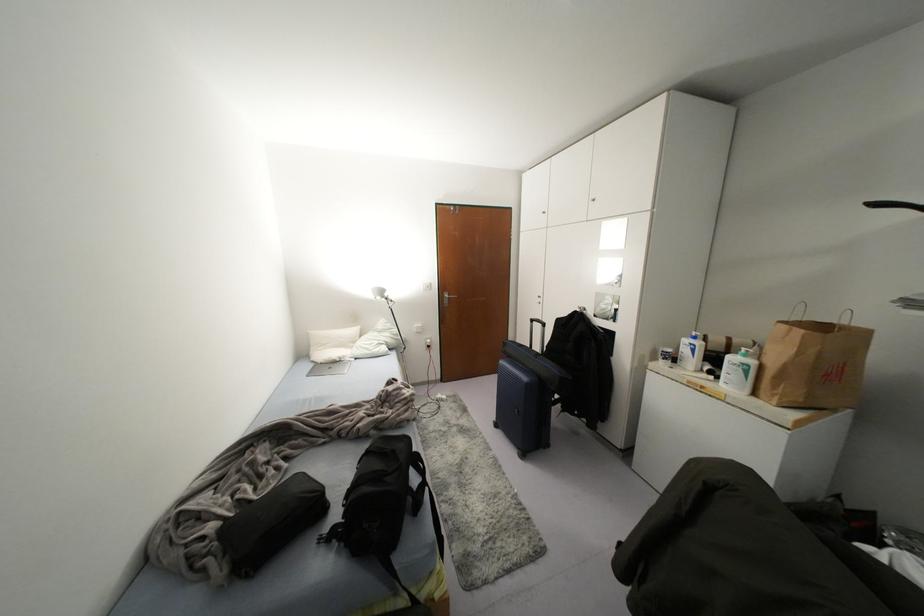
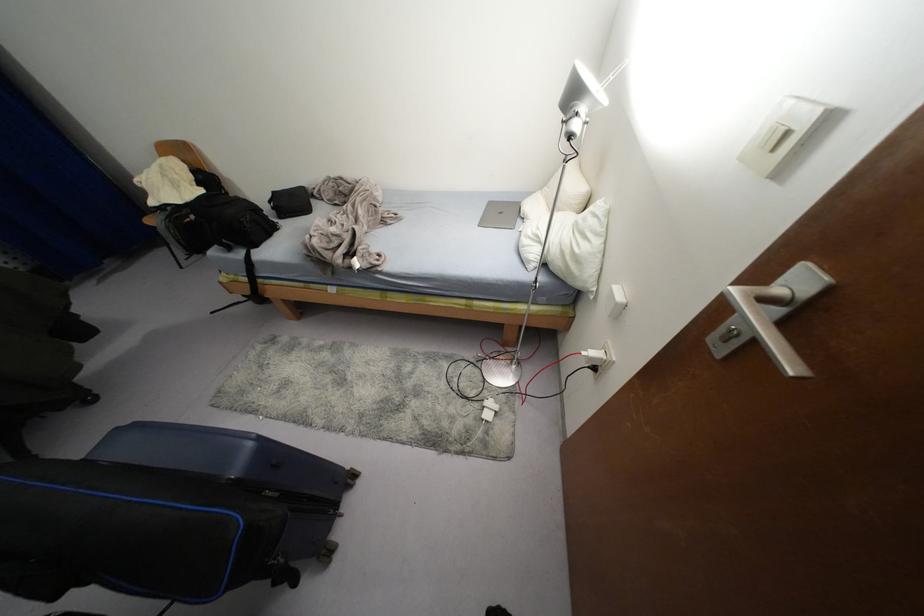
The point at (428,339) is marked in the first image. Where is the corresponding point in the second image?

(592, 353)